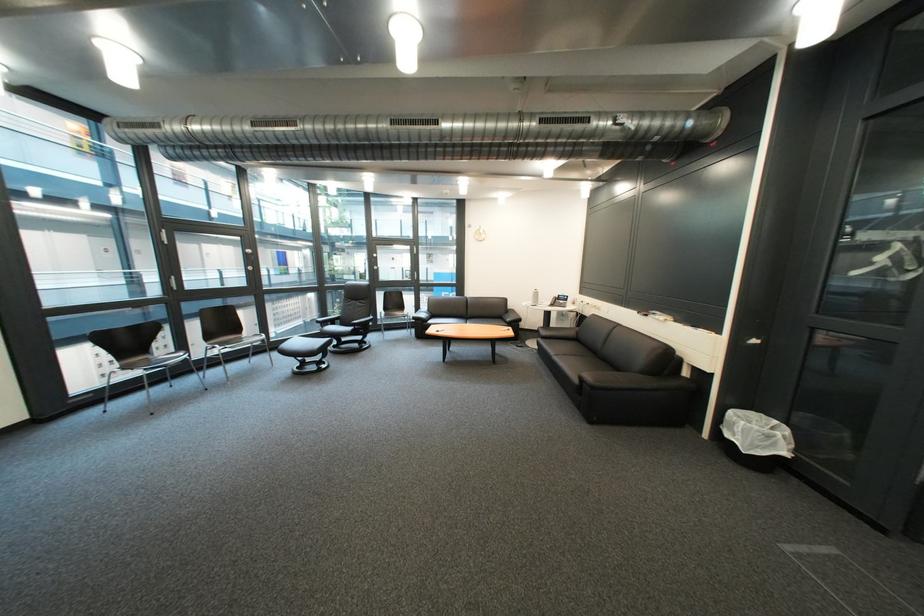
Find where to sit the sofa sitting surface. Please return your answer as a coordinate pair (x, y).

(467, 321)